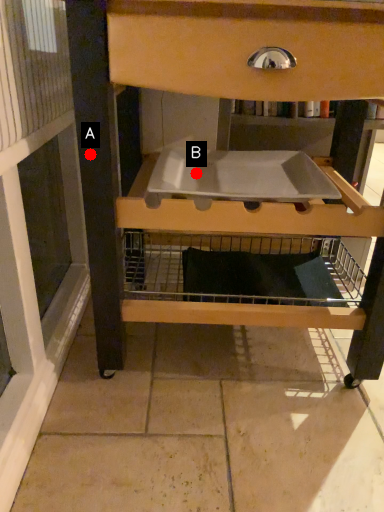
Question: Two points are circled on the image, labeled by A and B beside each circle. Which of the following is the closest to the observer?

Choices:
 (A) A is closer
 (B) B is closer

Answer: (A)